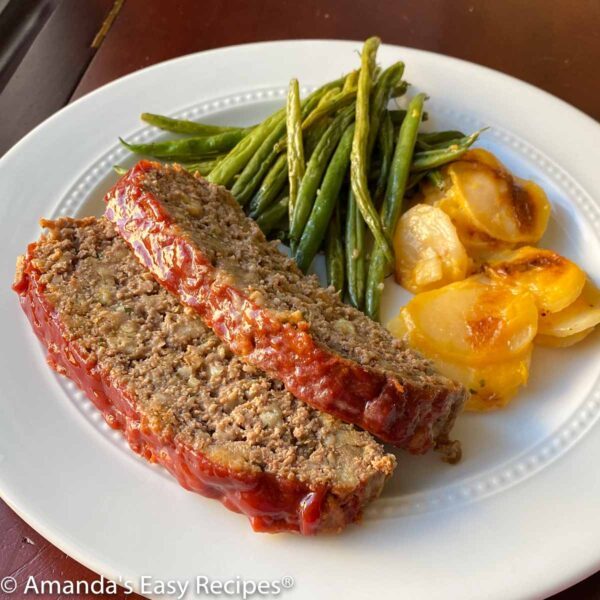
I want to click on table, so click(x=508, y=47).